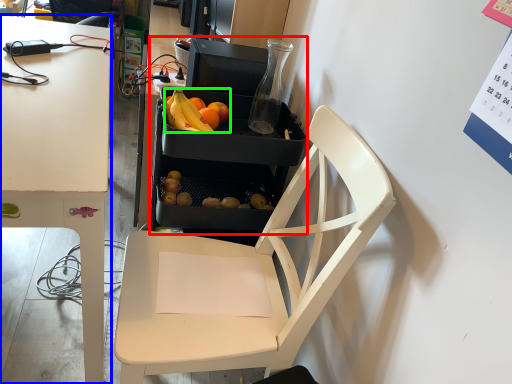
Question: Considering the real-world distances, which object is closest to appliance (highlighted by a red box)? desk (highlighted by a blue box) or grapefruit (highlighted by a green box).

Choices:
 (A) desk
 (B) grapefruit

Answer: (B)